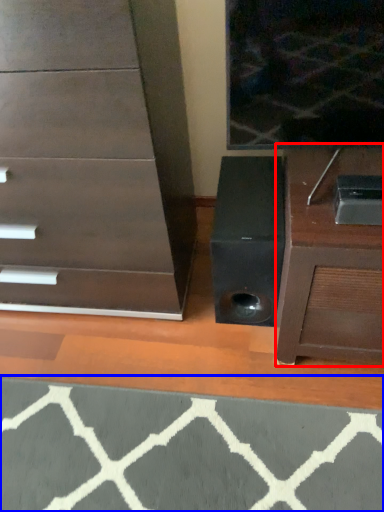
Question: Which object appears farthest to the camera in this image, furniture (highlighted by a red box) or doormat (highlighted by a blue box)?

Choices:
 (A) furniture
 (B) doormat

Answer: (A)